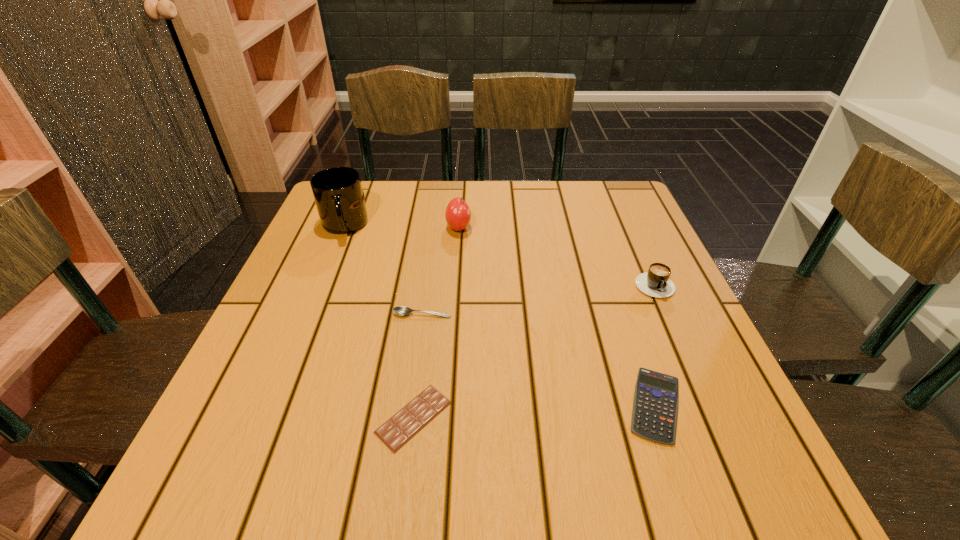
You are a GUI agent. You are given a task and a screenshot of the screen. Output one action in this format:
    pyautogui.click(x=<x>, y=<y>)
    Task: Click on the tallest object
    This screenshot has width=960, height=540.
    Given the screenshot: What is the action you would take?
    pyautogui.click(x=338, y=194)

Where is `mug`? mug is located at coordinates (338, 194).

In order to click on the second tallest object in this screenshot , I will do `click(458, 215)`.

Image resolution: width=960 pixels, height=540 pixels. I want to click on the third tallest object, so click(656, 283).

At what (x,y) coordinates should I click in order to perform the action: click on cappuccino. Please return your answer as a coordinate pair (x, y). Image resolution: width=960 pixels, height=540 pixels. Looking at the image, I should click on (656, 283).

The width and height of the screenshot is (960, 540). I want to click on soupspoon, so click(400, 310).

Locate an element on the screen. the third shortest object is located at coordinates (400, 310).

Where is `the second shortest object`? the second shortest object is located at coordinates (655, 406).

Where is `the shortest object`? The height and width of the screenshot is (540, 960). the shortest object is located at coordinates (407, 422).

Locate an element on the screen. free space located with the handle on the side of the leftmost object is located at coordinates (305, 320).